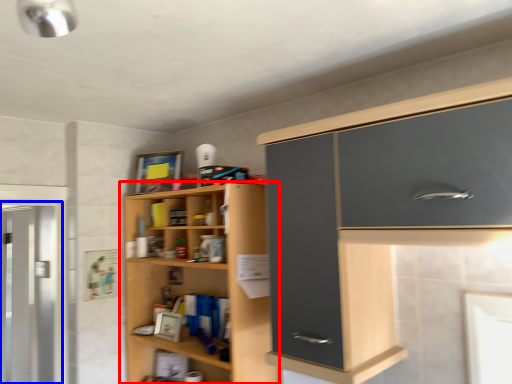
Question: Which point is further to the camera, cupboard (highlighted by a red box) or screen door (highlighted by a blue box)?

Choices:
 (A) cupboard
 (B) screen door

Answer: (B)